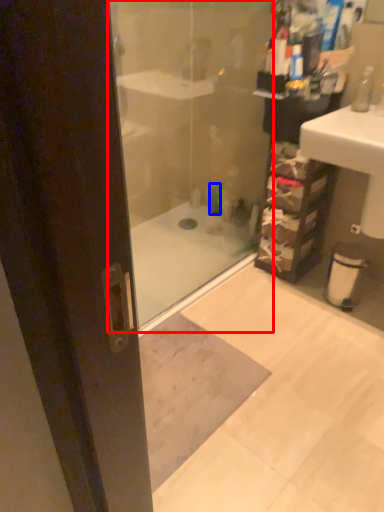
Question: Which point is further to the camera, shower door (highlighted by a red box) or toiletry (highlighted by a blue box)?

Choices:
 (A) shower door
 (B) toiletry

Answer: (B)